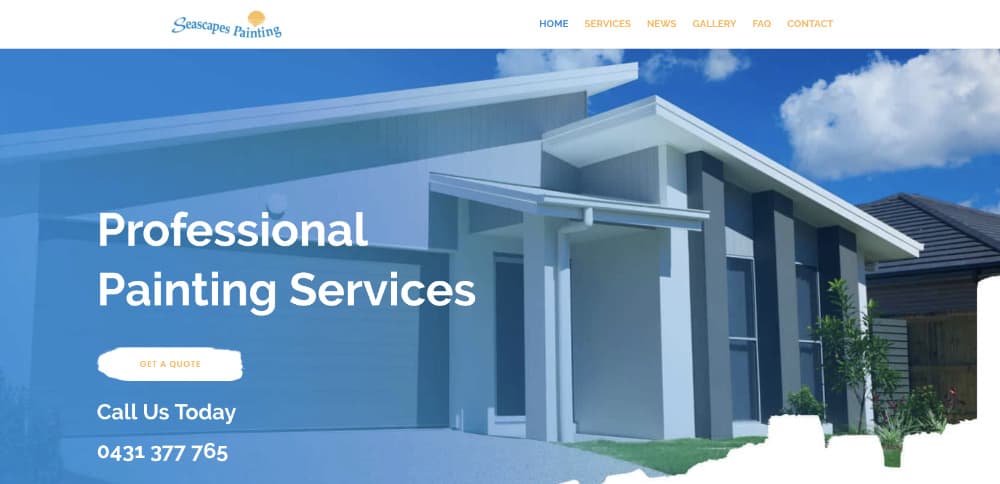
Find the location of a particular element. The height and width of the screenshot is (484, 1000). door is located at coordinates (509, 368).